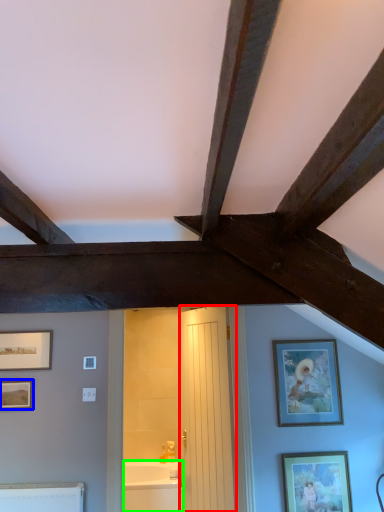
Question: Which is nearer to the door (highlighted by a red box)? picture frame (highlighted by a blue box) or bathtub (highlighted by a green box).

Choices:
 (A) picture frame
 (B) bathtub

Answer: (B)